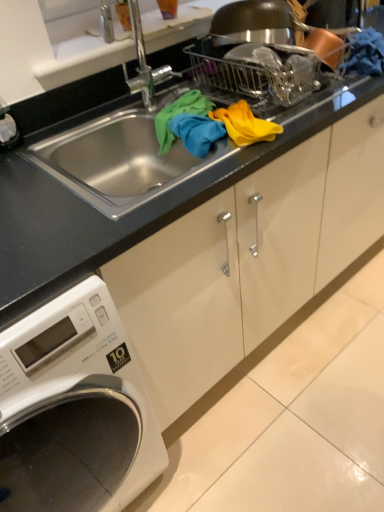
Question: Is point (238, 119) closer or farther from the camera than point (41, 162)?

Choices:
 (A) farther
 (B) closer

Answer: (A)

Question: From a real-world perspective, is yellow fabric at upper center physically located above or below black granite countertop at center?

Choices:
 (A) above
 (B) below

Answer: (B)

Question: Considering the real-world distances, which object is farthest from the white glossy washing machine at lower left?

Choices:
 (A) yellow fabric at upper center
 (B) black granite countertop at center

Answer: (A)

Question: Which is nearer to the yellow fabric at upper center?

Choices:
 (A) black granite countertop at center
 (B) white glossy washing machine at lower left

Answer: (A)